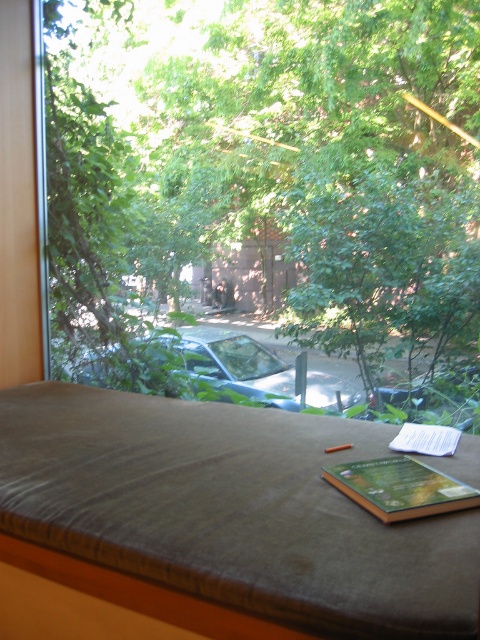
Question: Which point is closer to the camera?

Choices:
 (A) brown velvety bed at center
 (B) green leafy tree at center

Answer: (A)

Question: Does brown velvety bed at center appear over metallic silver car at center?

Choices:
 (A) no
 (B) yes

Answer: (B)

Question: Is metallic silver car at center closer to the viewer compared to hardcover book at center?

Choices:
 (A) no
 (B) yes

Answer: (A)

Question: Which point is closer to the camera?

Choices:
 (A) hardcover book at center
 (B) green leafy tree at center
 (C) metallic silver car at center

Answer: (A)

Question: Estimate the real-world distances between objects in this image. Which object is closer to the hardcover book at center?

Choices:
 (A) brown velvety bed at center
 (B) green leafy tree at center

Answer: (A)

Question: Is green leafy tree at center to the left of metallic silver car at center from the viewer's perspective?

Choices:
 (A) yes
 (B) no

Answer: (A)